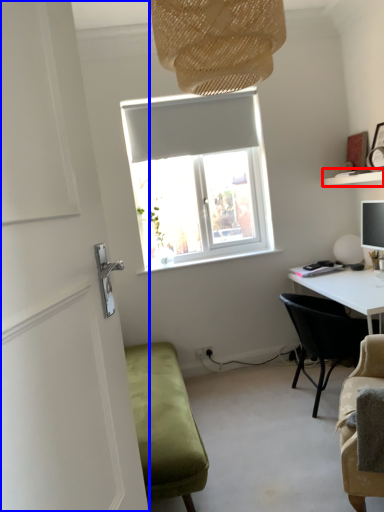
Question: Which point is closer to the camera, shelf (highlighted by a red box) or door (highlighted by a blue box)?

Choices:
 (A) shelf
 (B) door

Answer: (B)